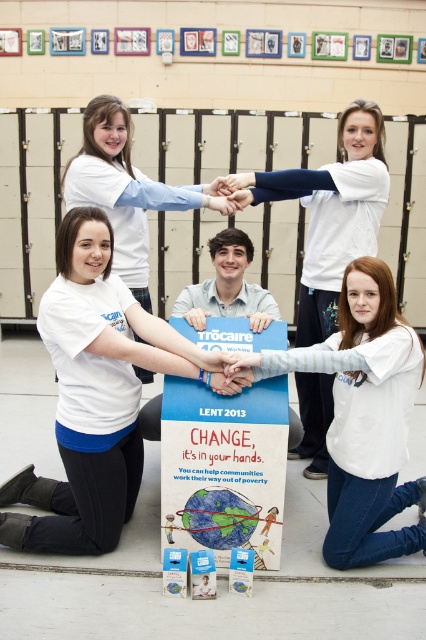
Question: Estimate the real-world distances between objects in this image. Which object is farther from the white matte t-shirt at lower right?

Choices:
 (A) white cotton shirt at upper center
 (B) white matte t-shirt at lower left
 (C) white matte t-shirt at upper center

Answer: (C)

Question: Which of these objects is positioned closest to the white matte t-shirt at lower left?

Choices:
 (A) white cotton shirt at upper center
 (B) white matte t-shirt at upper center

Answer: (B)

Question: From the image, what is the correct spatial relationship of white cotton shirt at upper center in relation to white matte t-shirt at upper center?

Choices:
 (A) right
 (B) left

Answer: (A)

Question: Which point is closer to the camera?

Choices:
 (A) (356, 314)
 (B) (158, 209)
 (C) (245, 177)

Answer: (A)

Question: Is white matte t-shirt at lower right closer to the viewer compared to white matte t-shirt at upper center?

Choices:
 (A) yes
 (B) no

Answer: (A)

Question: Is white cotton shirt at upper center further to the viewer compared to white matte t-shirt at upper center?

Choices:
 (A) yes
 (B) no

Answer: (A)